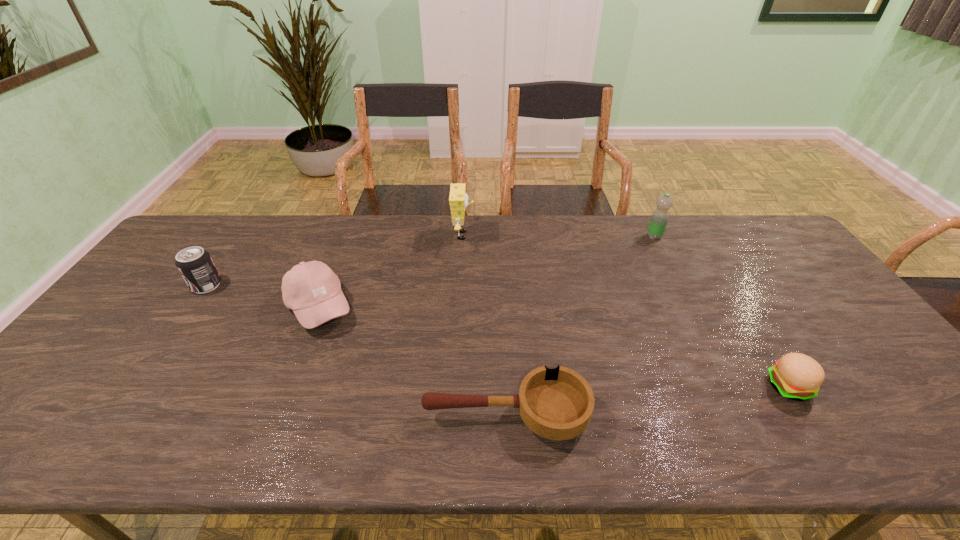
Find the location of a particular element. sponge is located at coordinates (458, 199).

The width and height of the screenshot is (960, 540). In order to click on the fifth object from left to right in this screenshot , I will do `click(658, 222)`.

Where is `baseball cap`? This screenshot has width=960, height=540. baseball cap is located at coordinates (312, 290).

Where is `soda can`? soda can is located at coordinates (195, 265).

What are the coordinates of `the rightmost object` in the screenshot? It's located at (796, 376).

Where is `saucepan`? The image size is (960, 540). saucepan is located at coordinates (557, 404).

Image resolution: width=960 pixels, height=540 pixels. In order to click on vacant area situated on the front-facing side of the sponge in this screenshot , I will do `click(521, 235)`.

Where is `vacant space located on the left of the fifth object from left to right`? This screenshot has width=960, height=540. vacant space located on the left of the fifth object from left to right is located at coordinates (535, 237).

The image size is (960, 540). What are the coordinates of `vacant space located 0.300m on the front-facing side of the baseball cap` in the screenshot? It's located at (461, 307).

Where is `free location located 0.240m on the right of the leftmost object`? Image resolution: width=960 pixels, height=540 pixels. free location located 0.240m on the right of the leftmost object is located at coordinates (301, 285).